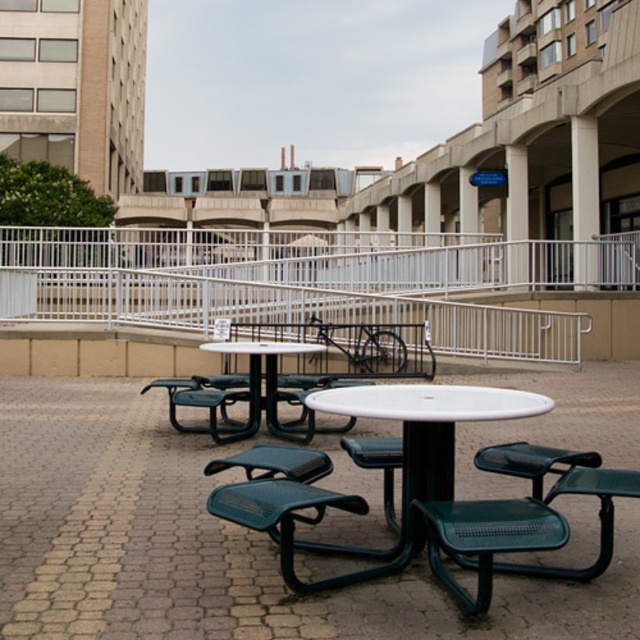
You are a painter who needs to decide which object to paint first between the white metal rail at upper center and the white concrete pillar at upper center. Since you want to paint the taller one first, which object should you choose?

The white metal rail at upper center is taller than the white concrete pillar at upper center, so you should paint the white metal rail at upper center first.